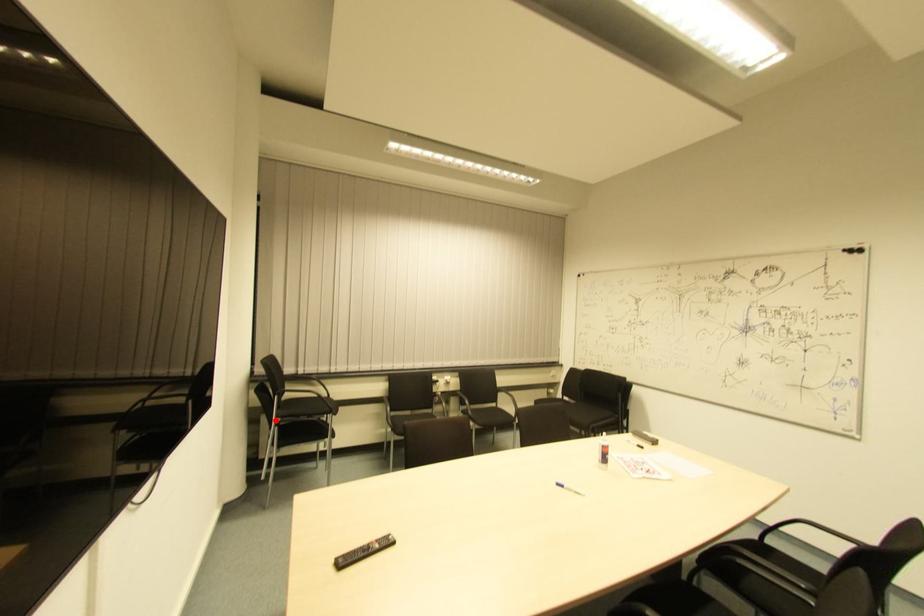
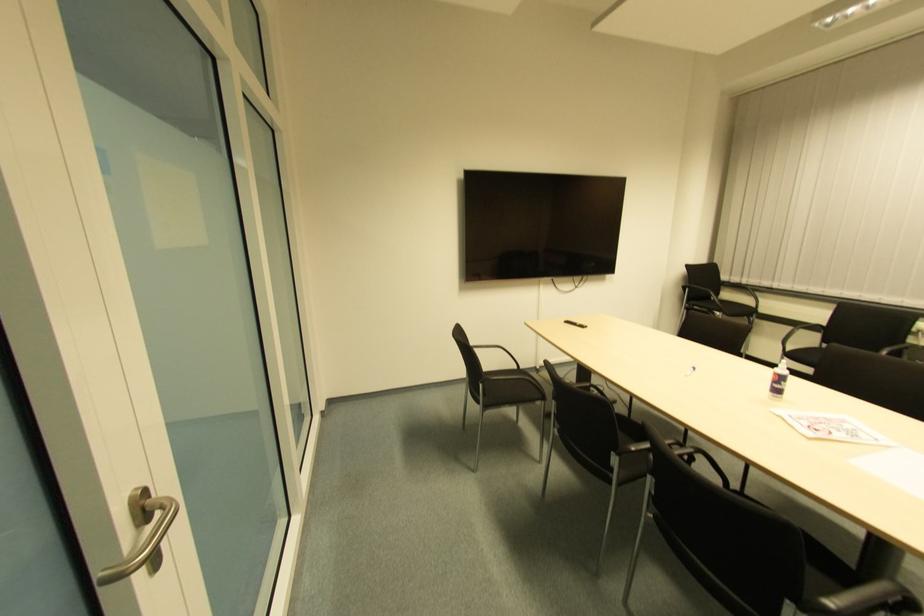
Where in the second image is the point corresponding to the highlighted location from the first image?

(685, 306)